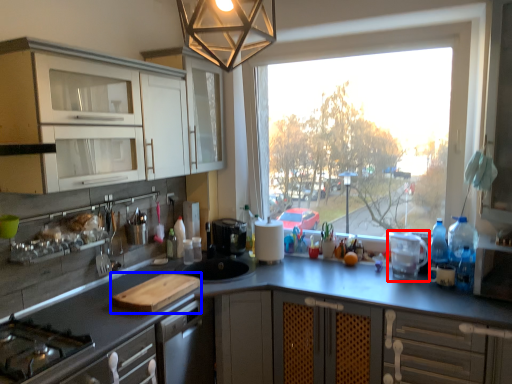
Question: Which of the following is the farthest to the observer, appliance (highlighted by a red box) or cutting board (highlighted by a blue box)?

Choices:
 (A) appliance
 (B) cutting board

Answer: (A)